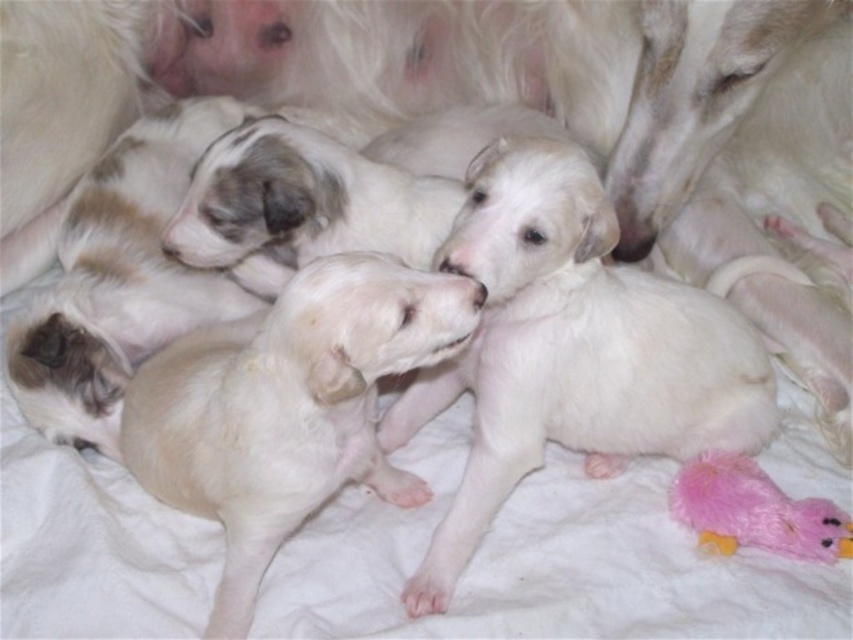
You are a photographer trying to capture a closeup of the white fluffy puppy at center. You are currently standing at the point with coordinates point (573,348). Is the white fluffy puppy at center directly in front of you?

The white fluffy puppy at center is located at point (573,348), so yes, the photographer is standing directly at the position of the white fluffy puppy at center. Therefore, the puppy is right in front of them.

You are a photographer trying to capture a closeup of the lighter puppy lying on its side. You notice two points marked in the image at coordinates point (131, 456) and point (683, 509). Which point should you focus on to ensure the lighter puppy is in focus?

Point (131, 456) is in front of point (683, 509), so focusing on point (131, 456) will ensure the lighter puppy lying on its side is in focus.

You are standing 5 feet away from the point at coordinates point (527, 451). If you move forward 1.5 feet, will you be closer to or farther from the point?

The distance of point (527, 451) from viewer is 3.63 feet. Moving forward 1.5 feet from 5 feet away would bring you to 3.5 feet away, which is closer to the point.